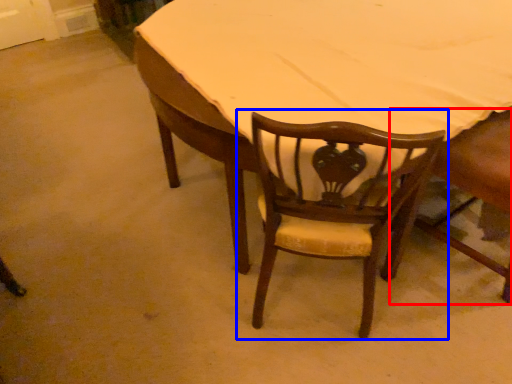
Question: Which object appears farthest to the camera in this image, chair (highlighted by a red box) or chair (highlighted by a blue box)?

Choices:
 (A) chair
 (B) chair

Answer: (A)